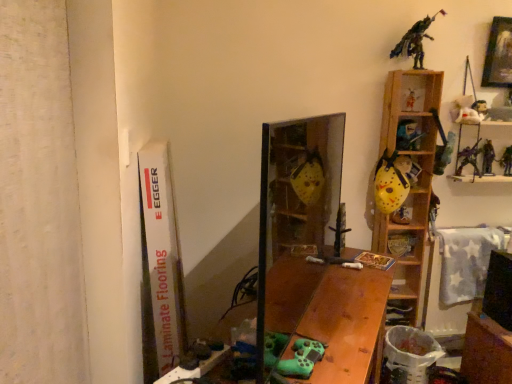
At what (x,y) coordinates should I click in order to perform the action: click on wooden table at center, positioned as the 2th table in right-to-left order. Please return your answer as a coordinate pair (x, y). Image resolution: width=512 pixels, height=384 pixels. Looking at the image, I should click on (329, 313).

The height and width of the screenshot is (384, 512). What are the coordinates of `black plastic sword at center, the 11th toy in the right-to-left sequence` in the screenshot? It's located at (340, 230).

Locate an element on the screen. yellow matte hockey mask at right, placed as the 10th toy when sorted from right to left is located at coordinates (391, 181).

This screenshot has width=512, height=384. What do you see at coordinates (408, 135) in the screenshot?
I see `metallic blue toy at upper right, which is the 7th toy in left-to-right order` at bounding box center [408, 135].

Locate an element on the screen. wooden table at center, the first table positioned from the left is located at coordinates pyautogui.click(x=329, y=313).

Choose the correct answer: Is metallic figure at upper right, positioned as the ninth toy in right-to-left order, inside wooden picture frame at upper right or outside it?

The correct answer is: outside.

From the image's perspective, is metallic figure at upper right, positioned as the ninth toy in right-to-left order, beneath wooden picture frame at upper right?

Yes, from the image's perspective, metallic figure at upper right, positioned as the ninth toy in right-to-left order, is below wooden picture frame at upper right.

Would you consider metallic figure at upper right, positioned as the ninth toy in right-to-left order, to be distant from wooden picture frame at upper right?

metallic figure at upper right, positioned as the ninth toy in right-to-left order, is near wooden picture frame at upper right, not far away.

Could you tell me if metallic silver figure at upper right, the 8th toy when ordered from right to left, is turned towards metallic figure at upper right, positioned as the ninth toy in right-to-left order?

No, metallic silver figure at upper right, the 8th toy when ordered from right to left, is not facing towards metallic figure at upper right, positioned as the ninth toy in right-to-left order.

Considering the relative sizes of metallic silver figure at upper right, the 8th toy when ordered from right to left, and metallic figure at upper right, positioned as the ninth toy in right-to-left order, in the image provided, is metallic silver figure at upper right, the 8th toy when ordered from right to left, shorter than metallic figure at upper right, positioned as the ninth toy in right-to-left order,?

Indeed, metallic silver figure at upper right, the 8th toy when ordered from right to left, has a lesser height compared to metallic figure at upper right, positioned as the ninth toy in right-to-left order.

Between metallic silver figure at upper right, the 8th toy when ordered from right to left, and metallic figure at upper right, positioned as the ninth toy in right-to-left order, which one has larger width?

With larger width is metallic figure at upper right, positioned as the ninth toy in right-to-left order.

Is metallic silver figure at upper right, the fifth toy when ordered from left to right, not close to metallic figure at upper right, acting as the fourth toy starting from the left?

No, there isn't a large distance between metallic silver figure at upper right, the fifth toy when ordered from left to right, and metallic figure at upper right, acting as the fourth toy starting from the left.

Which is behind, point (376, 170) or point (474, 360)?

The point (376, 170) is more distant.

Is yellow matte hockey mask at right, placed as the 10th toy when sorted from right to left, touching wooden table at lower right, arranged as the second table when viewed from the left?

yellow matte hockey mask at right, placed as the 10th toy when sorted from right to left, and wooden table at lower right, arranged as the second table when viewed from the left, are not in contact.

In terms of height, does yellow matte hockey mask at right, placed as the 10th toy when sorted from right to left, look taller or shorter compared to wooden table at lower right, arranged as the second table when viewed from the left?

In the image, yellow matte hockey mask at right, placed as the 10th toy when sorted from right to left, appears to be shorter than wooden table at lower right, arranged as the second table when viewed from the left.

Where is `the 8th toy to the left when counting from the wooden table at lower right, the first table positioned from the right`? the 8th toy to the left when counting from the wooden table at lower right, the first table positioned from the right is located at coordinates (391, 181).

Is metallic silver figure at upper right, which is the 11th toy from left to right, wider or thinner than wooden shelves at upper right?

Considering their sizes, metallic silver figure at upper right, which is the 11th toy from left to right, looks slimmer than wooden shelves at upper right.

Between metallic silver figure at upper right, which ranks as the 2th toy in right-to-left order, and wooden shelves at upper right, which one has more height?

Standing taller between the two is wooden shelves at upper right.

Would you say metallic silver figure at upper right, which ranks as the 2th toy in right-to-left order, is to the left or to the right of wooden shelves at upper right in the picture?

Clearly, metallic silver figure at upper right, which ranks as the 2th toy in right-to-left order, is on the right of wooden shelves at upper right in the image.

Is wooden table at center, positioned as the 2th table in right-to-left order, outside of wooden picture frame at upper right?

Yes, wooden table at center, positioned as the 2th table in right-to-left order, is outside of wooden picture frame at upper right.

Is wooden table at center, positioned as the 2th table in right-to-left order, far away from wooden picture frame at upper right?

Yes, wooden table at center, positioned as the 2th table in right-to-left order, and wooden picture frame at upper right are located far from each other.

In terms of width, does wooden table at center, positioned as the 2th table in right-to-left order, look wider or thinner when compared to wooden picture frame at upper right?

wooden table at center, positioned as the 2th table in right-to-left order, is wider than wooden picture frame at upper right.

Does point (354, 303) lie behind point (494, 45)?

No, (354, 303) is in front of (494, 45).

From a real-world perspective, is metallic silver toy at upper right, which is the twelfth toy in left-to-right order, physically located above or below yellow matte hockey mask at upper right, the sixth toy viewed from the left?

From a real-world perspective, metallic silver toy at upper right, which is the twelfth toy in left-to-right order, is physically above yellow matte hockey mask at upper right, the sixth toy viewed from the left.

Is metallic silver toy at upper right, which is the twelfth toy in left-to-right order, positioned beyond the bounds of yellow matte hockey mask at upper right, which is the seventh toy in right-to-left order?

Yes, metallic silver toy at upper right, which is the twelfth toy in left-to-right order, is located beyond the bounds of yellow matte hockey mask at upper right, which is the seventh toy in right-to-left order.

Does metallic silver toy at upper right, arranged as the 1th toy when viewed from the right, have a lesser height compared to yellow matte hockey mask at upper right, the sixth toy viewed from the left?

No.

Is metallic silver toy at upper right, which is the twelfth toy in left-to-right order, with yellow matte hockey mask at upper right, the sixth toy viewed from the left?

No, metallic silver toy at upper right, which is the twelfth toy in left-to-right order, is not touching yellow matte hockey mask at upper right, the sixth toy viewed from the left.

Is green matte controller at lower center, arranged as the 12th toy when viewed from the right, not close to metallic silver toy at upper right, arranged as the 1th toy when viewed from the right?

Yes, green matte controller at lower center, arranged as the 12th toy when viewed from the right, is far from metallic silver toy at upper right, arranged as the 1th toy when viewed from the right.

Is green matte controller at lower center, arranged as the 12th toy when viewed from the right, behind metallic silver toy at upper right, which is the twelfth toy in left-to-right order?

No, green matte controller at lower center, arranged as the 12th toy when viewed from the right, is closer to the viewer.

Can metallic silver toy at upper right, which is the twelfth toy in left-to-right order, be found inside green matte controller at lower center, which is counted as the 1th toy, starting from the left?

No, metallic silver toy at upper right, which is the twelfth toy in left-to-right order, is not surrounded by green matte controller at lower center, which is counted as the 1th toy, starting from the left.

Is green matte controller at lower center, which is counted as the 1th toy, starting from the left, looking in the opposite direction of metallic silver toy at upper right, which is the twelfth toy in left-to-right order?

No, metallic silver toy at upper right, which is the twelfth toy in left-to-right order, is not at the back of green matte controller at lower center, which is counted as the 1th toy, starting from the left.

At what (x,y) coordinates should I click in order to perform the action: click on picture frame that appears above the metallic figure at upper right, acting as the fourth toy starting from the left (from the image's perspective). Please return your answer as a coordinate pair (x, y). Image resolution: width=512 pixels, height=384 pixels. Looking at the image, I should click on (498, 54).

This screenshot has width=512, height=384. Identify the location of the 1st toy below the metallic figure at upper right, positioned as the ninth toy in right-to-left order (from the image's perspective). (413, 100).

Based on their spatial positions, is metallic silver action figure at upper right, which is the ninth toy in left-to-right order, or yellow matte hockey mask at right, which is the third toy from left to right, closer to wooden table at lower right, the first table positioned from the right?

Among the two, yellow matte hockey mask at right, which is the third toy from left to right, is located nearer to wooden table at lower right, the first table positioned from the right.

From the image, which object appears to be farther from wooden table at center, the first table positioned from the left, metallic silver action figure at upper right, acting as the 4th toy starting from the right, or black plastic sword at center, the 11th toy in the right-to-left sequence?

metallic silver action figure at upper right, acting as the 4th toy starting from the right, is further to wooden table at center, the first table positioned from the left.

Consider the image. Looking at the image, which one is located further to yellow matte hockey mask at right, which is the third toy from left to right, plush white bear at upper right, the third toy in the right-to-left sequence, or wooden shelves at upper right?

Among the two, plush white bear at upper right, the third toy in the right-to-left sequence, is located further to yellow matte hockey mask at right, which is the third toy from left to right.

Looking at this image, estimate the real-world distances between objects in this image. Which object is closer to yellow matte hockey mask at upper right, which is the seventh toy in right-to-left order, yellow matte hockey mask at right, which is the third toy from left to right, or wooden picture frame at upper right?

yellow matte hockey mask at right, which is the third toy from left to right, is positioned closer to the anchor yellow matte hockey mask at upper right, which is the seventh toy in right-to-left order.

Estimate the real-world distances between objects in this image. Which object is closer to yellow matte hockey mask at right, which is the third toy from left to right, black plastic sword at center, the 11th toy in the right-to-left sequence, or metallic silver toy at upper right, which is the twelfth toy in left-to-right order?

black plastic sword at center, the 11th toy in the right-to-left sequence.

Which object lies nearer to the anchor point metallic blue toy at upper right, marked as the 6th toy in a right-to-left arrangement, plush white bear at upper right, the third toy in the right-to-left sequence, or metallic silver action figure at upper right, acting as the 4th toy starting from the right?

The object closer to metallic blue toy at upper right, marked as the 6th toy in a right-to-left arrangement, is metallic silver action figure at upper right, acting as the 4th toy starting from the right.

When comparing their distances from metallic silver figure at upper right, the fifth toy when ordered from left to right, does wooden picture frame at upper right or wooden table at center, the first table positioned from the left, seem closer?

Among the two, wooden picture frame at upper right is located nearer to metallic silver figure at upper right, the fifth toy when ordered from left to right.

In the scene shown: Considering their positions, is wooden table at center, the first table positioned from the left, positioned closer to wooden shelves at upper right than metallic silver figure at upper right, the fifth toy when ordered from left to right?

metallic silver figure at upper right, the fifth toy when ordered from left to right, is positioned closer to the anchor wooden shelves at upper right.

This screenshot has height=384, width=512. In order to click on shelf between wooden picture frame at upper right and yellow matte hockey mask at upper right, which is the seventh toy in right-to-left order, in the up-down direction in this screenshot , I will do `click(411, 184)`.

Identify the location of shelf between yellow matte hockey mask at right, placed as the 10th toy when sorted from right to left, and wooden table at lower right, the first table positioned from the right, from top to bottom. (411, 184).

Where is `shelf between yellow matte hockey mask at right, placed as the 10th toy when sorted from right to left, and metallic silver action figure at upper right, acting as the 4th toy starting from the right, from left to right`? Image resolution: width=512 pixels, height=384 pixels. shelf between yellow matte hockey mask at right, placed as the 10th toy when sorted from right to left, and metallic silver action figure at upper right, acting as the 4th toy starting from the right, from left to right is located at coordinates (411, 184).

The image size is (512, 384). What are the coordinates of `table between wooden table at center, the first table positioned from the left, and black plastic sword at center, positioned as the 2th toy in left-to-right order, in the front-back direction` in the screenshot? It's located at (486, 351).